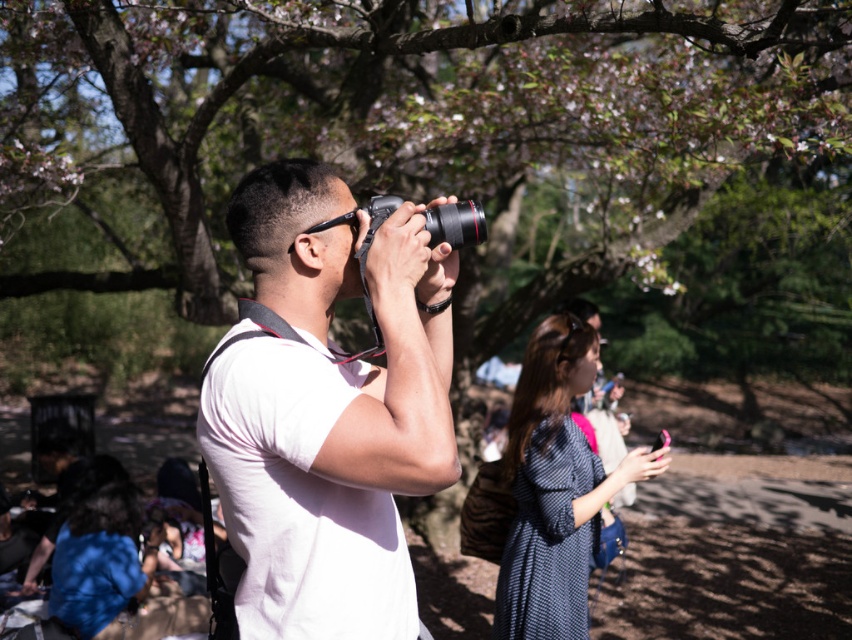
You are standing in the park and see a man taking a photo with a camera. There is a point marked at coordinates (554, 486). What is located at that point?

The point at coordinates (554, 486) indicates the location of the dark blue textured dress at center.

You are a photographer who wants to ensure both the white matte camera at center and the black plastic camera at center are visible in your photo. Given that your lens has a minimum focus distance of 10 inches, will both cameras be in focus?

The distance between the white matte camera at center and the black plastic camera at center is 10.16 inches. Since this exceeds the minimum focus distance of 10 inches, both cameras will be in focus.

From the picture: You are standing at the point with coordinates point (321, 349) and want to walk to the point with coordinates point (539, 433). Which direction should you move?

You should move backward because point (321, 349) is in front of point (539, 433), so moving backward will take you toward the desired point.